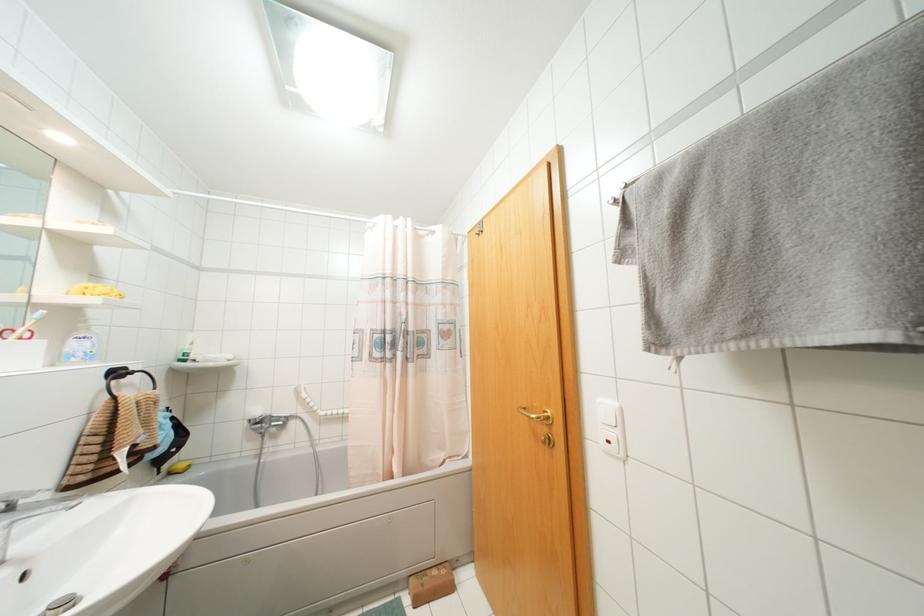
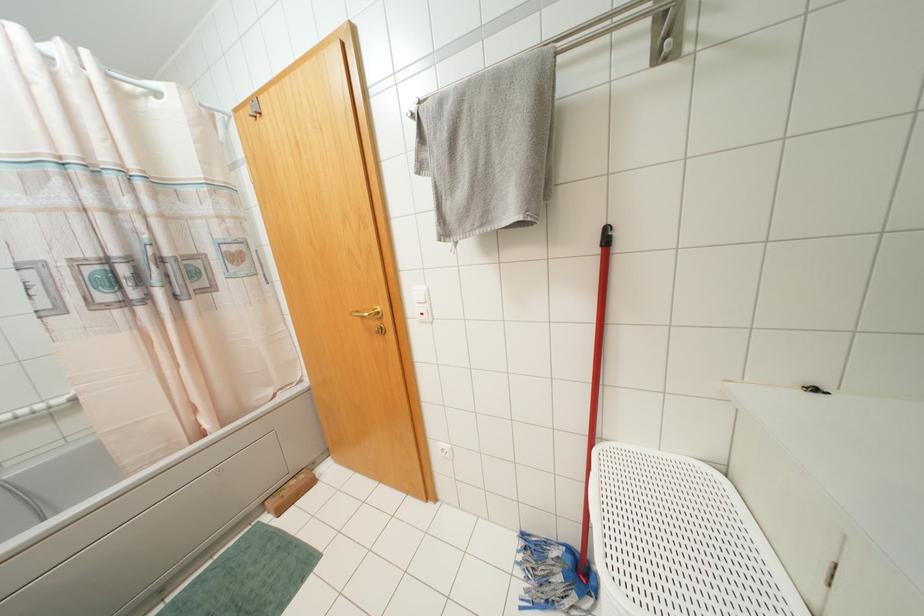
Where in the second image is the point corresponding to point (744, 336) from the first image?

(481, 225)